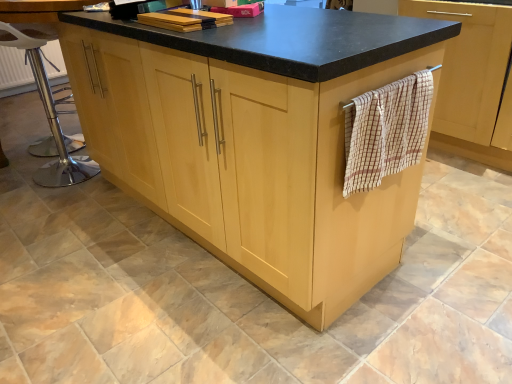
Question: Is wooden towel rack at right turned away from beige checkered towel at right?

Choices:
 (A) yes
 (B) no

Answer: (B)

Question: Considering the relative sizes of wooden towel rack at right and beige checkered towel at right in the image provided, is wooden towel rack at right wider than beige checkered towel at right?

Choices:
 (A) no
 (B) yes

Answer: (B)

Question: From the image's perspective, is wooden towel rack at right located beneath beige checkered towel at right?

Choices:
 (A) no
 (B) yes

Answer: (A)

Question: From the image's perspective, is wooden towel rack at right located above beige checkered towel at right?

Choices:
 (A) no
 (B) yes

Answer: (B)

Question: Is wooden towel rack at right behind beige checkered towel at right?

Choices:
 (A) yes
 (B) no

Answer: (A)

Question: Is point (356, 74) positioned closer to the camera than point (41, 38)?

Choices:
 (A) closer
 (B) farther

Answer: (A)

Question: Relative to polished chrome bar stool at left, is light wood cupboard at center in front or behind?

Choices:
 (A) front
 (B) behind

Answer: (A)

Question: Based on their sizes in the image, would you say light wood cupboard at center is bigger or smaller than polished chrome bar stool at left?

Choices:
 (A) small
 (B) big

Answer: (B)

Question: From a real-world perspective, relative to polished chrome bar stool at left, is light wood cupboard at center vertically above or below?

Choices:
 (A) above
 (B) below

Answer: (A)

Question: Looking at their shapes, would you say beige checkered towel at right is wider or thinner than polished chrome bar stool at left?

Choices:
 (A) thin
 (B) wide

Answer: (B)

Question: From a real-world perspective, is beige checkered towel at right positioned above or below polished chrome bar stool at left?

Choices:
 (A) below
 (B) above

Answer: (B)

Question: Considering the positions of beige checkered towel at right and polished chrome bar stool at left in the image, is beige checkered towel at right bigger or smaller than polished chrome bar stool at left?

Choices:
 (A) small
 (B) big

Answer: (A)

Question: Which is correct: beige checkered towel at right is inside polished chrome bar stool at left, or outside of it?

Choices:
 (A) outside
 (B) inside

Answer: (A)

Question: Do you think polished chrome bar stool at left is within beige checkered towel at right, or outside of it?

Choices:
 (A) outside
 (B) inside

Answer: (A)

Question: In the image, is polished chrome bar stool at left on the left side or the right side of beige checkered towel at right?

Choices:
 (A) left
 (B) right

Answer: (A)